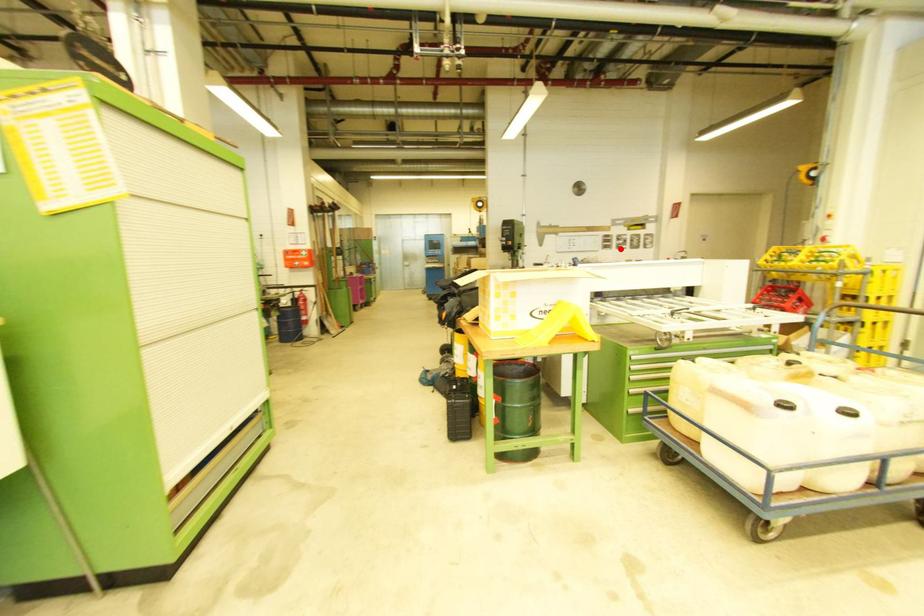
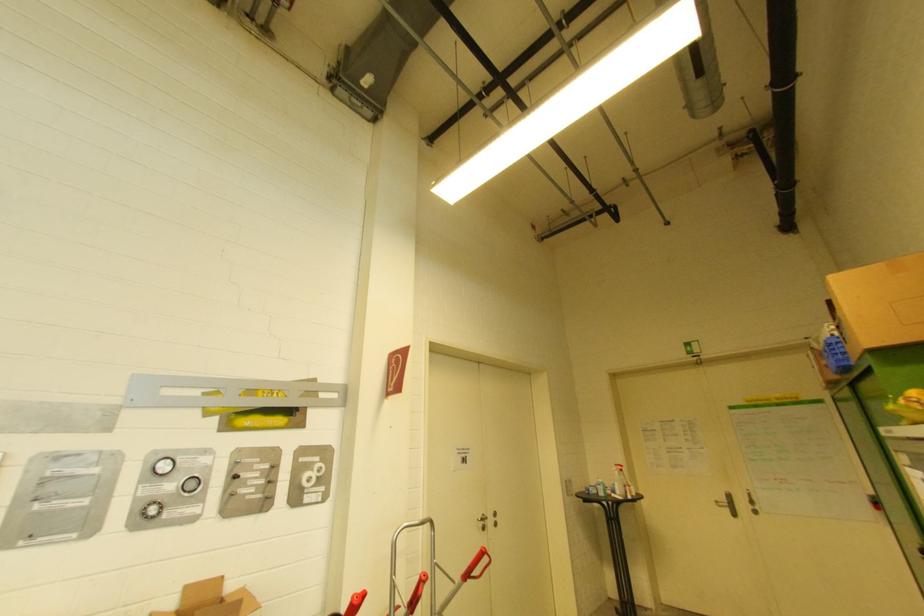
Question: I am providing you with two images of the same scene from different viewpoints. Given a red point in image1, look at the same physical point in image2. Is it:

Choices:
 (A) Closer to the viewpoint
 (B) Farther from the viewpoint

Answer: (B)